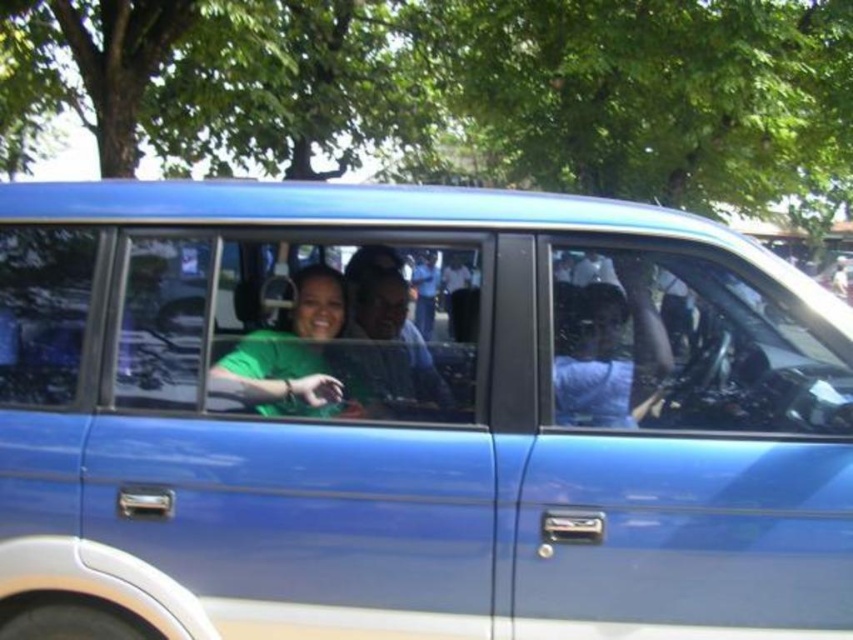
Question: Which object is farther from the camera taking this photo?

Choices:
 (A) blue metallic minivan at center
 (B) transparent glass window at center

Answer: (B)

Question: Does green matte shirt at center appear over matte green shirt at center?

Choices:
 (A) yes
 (B) no

Answer: (B)

Question: Does blue metallic minivan at center have a larger size compared to matte green shirt at center?

Choices:
 (A) no
 (B) yes

Answer: (B)

Question: Which object is positioned farthest from the matte green shirt at center?

Choices:
 (A) blue metallic minivan at center
 (B) matte black man at center

Answer: (A)

Question: Which is farther from the transparent glass window at center?

Choices:
 (A) blue metallic minivan at center
 (B) transparent glass steering wheel at center
 (C) matte black man at center
 (D) matte green shirt at center

Answer: (B)

Question: Does green matte shirt at center appear under matte black man at center?

Choices:
 (A) yes
 (B) no

Answer: (A)